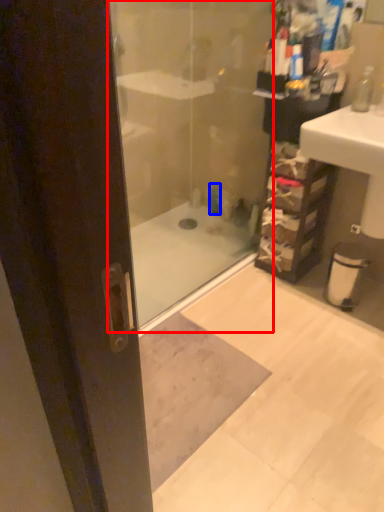
Question: Which of the following is the closest to the observer, shower door (highlighted by a red box) or toiletry (highlighted by a blue box)?

Choices:
 (A) shower door
 (B) toiletry

Answer: (A)